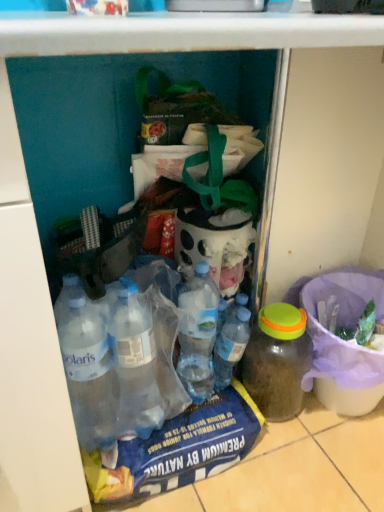
Question: In terms of size, does translucent plastic jar at lower right, arranged as the 2th bottle when viewed from the left, appear bigger or smaller than translucent plastic bucket at lower right?

Choices:
 (A) big
 (B) small

Answer: (B)

Question: Is translucent plastic jar at lower right, which appears as the 1th bottle when viewed from the right, wider or thinner than translucent plastic bucket at lower right?

Choices:
 (A) wide
 (B) thin

Answer: (B)

Question: Estimate the real-world distances between objects in this image. Which object is closer to the transparent plastic bottle at center, which appears as the second bottle when viewed from the right?

Choices:
 (A) translucent plastic bucket at lower right
 (B) translucent plastic jar at lower right, which appears as the 1th bottle when viewed from the right

Answer: (B)

Question: Which of these objects is positioned farthest from the translucent plastic jar at lower right, which appears as the 1th bottle when viewed from the right?

Choices:
 (A) transparent plastic bottle at center, which is the first bottle from left to right
 (B) translucent plastic bucket at lower right

Answer: (B)